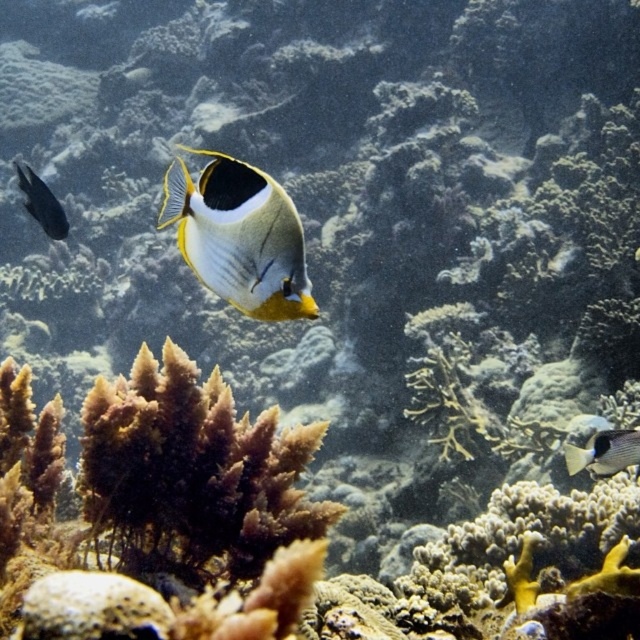
Question: Is yellow and white butterflyfish at center below shiny black fish at left?

Choices:
 (A) no
 (B) yes

Answer: (B)

Question: Which point is closer to the camera?

Choices:
 (A) (51, 212)
 (B) (637, 445)

Answer: (B)

Question: Which object is farther from the camera taking this photo?

Choices:
 (A) shiny black fish at left
 (B) gray matte fish at right
 (C) yellow and white butterflyfish at center

Answer: (A)

Question: Does gray matte fish at right appear on the right side of shiny black fish at left?

Choices:
 (A) no
 (B) yes

Answer: (B)

Question: Can you confirm if yellow and white butterflyfish at center is thinner than gray matte fish at right?

Choices:
 (A) yes
 (B) no

Answer: (B)

Question: Which of these objects is positioned farthest from the gray matte fish at right?

Choices:
 (A) yellow and white butterflyfish at center
 (B) shiny black fish at left

Answer: (B)